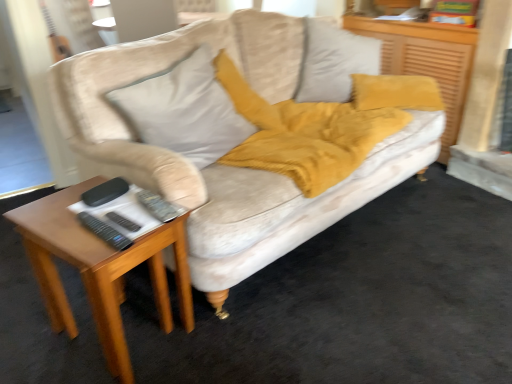
In order to click on free space above woodenmaterial/texturetable at left (from a real-world perspective) in this screenshot , I will do `click(102, 216)`.